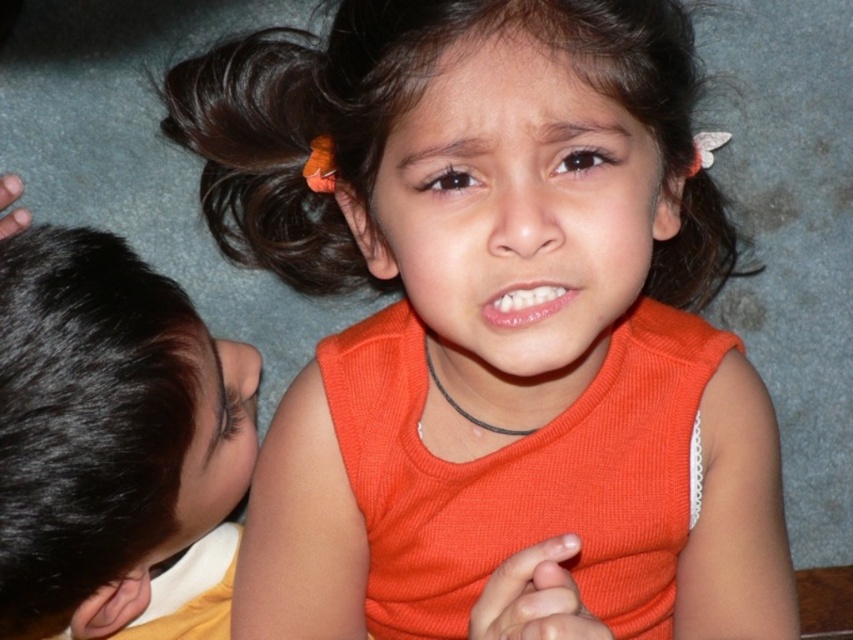
Question: Which of the following is the farthest from the observer?

Choices:
 (A) brown matte hair at upper center
 (B) black hair at left

Answer: (B)

Question: Can you confirm if black hair at left is positioned to the right of brown matte hair at upper center?

Choices:
 (A) yes
 (B) no

Answer: (B)

Question: Which point appears closest to the camera in this image?

Choices:
 (A) (45, 372)
 (B) (318, 282)

Answer: (A)

Question: Is the position of black hair at left less distant than that of brown matte hair at upper center?

Choices:
 (A) yes
 (B) no

Answer: (B)

Question: Is black hair at left further to camera compared to brown matte hair at upper center?

Choices:
 (A) no
 (B) yes

Answer: (B)